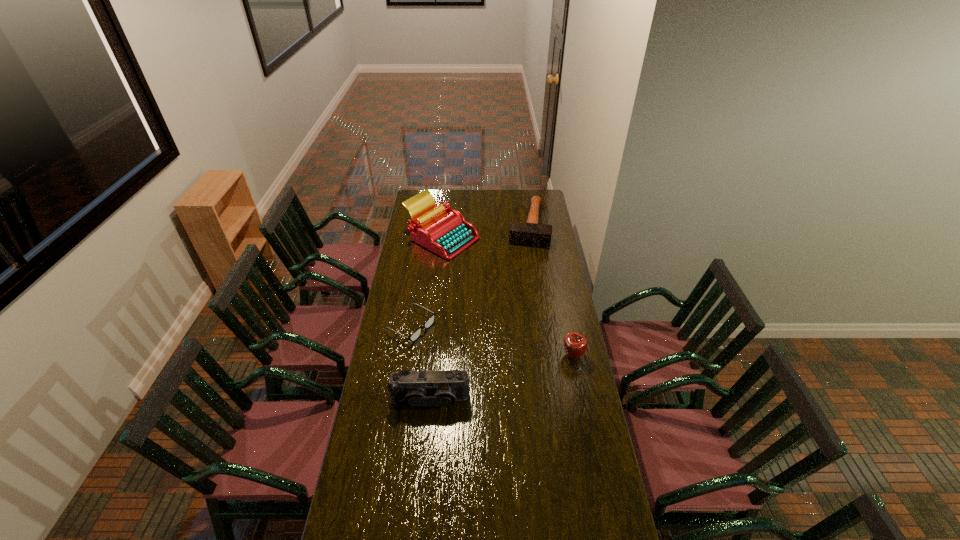
Image resolution: width=960 pixels, height=540 pixels. What are the coordinates of `blank space located 0.380m on the striking face of the fourth tallest object` in the screenshot? It's located at 519,292.

You are a GUI agent. You are given a task and a screenshot of the screen. Output one action in this format:
    pyautogui.click(x=<x>, y=<y>)
    Task: Click on the vacant space located 0.310m on the striking face of the fourth tallest object
    This screenshot has width=960, height=540.
    Given the screenshot: What is the action you would take?
    [x=521, y=283]

Locate an element on the screen. vacant space located on the front-facing side of the spectacles is located at coordinates (472, 360).

Locate an element on the screen. The height and width of the screenshot is (540, 960). blank space located 0.280m on the front-facing side of the spectacles is located at coordinates (479, 364).

Locate an element on the screen. The image size is (960, 540). vacant space situated 0.290m on the front-facing side of the spectacles is located at coordinates (481, 365).

The width and height of the screenshot is (960, 540). Identify the location of free space located 0.380m on the typing side of the typewriter. (478, 302).

Find the location of `vacant space positioned 0.200m on the typing side of the typewriter`. vacant space positioned 0.200m on the typing side of the typewriter is located at coordinates (467, 281).

Find the location of a particular element. vacant space located 0.400m on the typing side of the typewriter is located at coordinates 480,305.

Locate an element on the screen. This screenshot has height=540, width=960. object at the far edge is located at coordinates (530, 233).

Locate an element on the screen. camcorder present at the left edge is located at coordinates (443, 388).